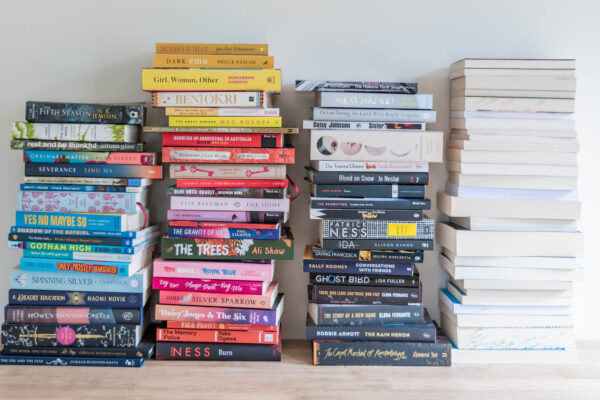
Image resolution: width=600 pixels, height=400 pixels. Find the location of `stacks on books`. stacks on books is located at coordinates [100, 102], [197, 44], [351, 78], [552, 58].